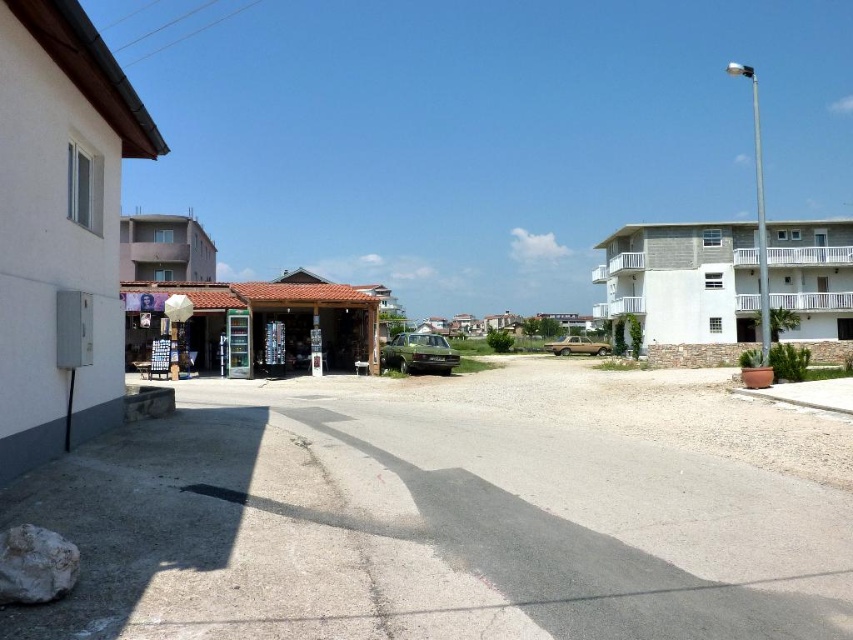
You are a city planner analyzing the layout of this street. Which building, the white concrete building at right or the gray concrete building at upper left, is shorter?

The white concrete building at right has a lesser height compared to the gray concrete building at upper left, so the white concrete building at right is shorter.

You are standing on the sidewalk in front of the small shop with a red tiled roof. You want to take a photo of both the white concrete building at right and the white concrete building at center. Which building should you look up towards to include both in your photo?

You should look up towards the white concrete building at right because it is located above the white concrete building at center, so positioning your camera to capture the one above will naturally include the lower one in the frame as well.